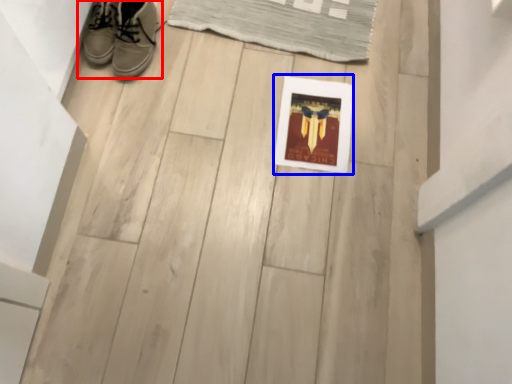
Question: Which of the following is the farthest to the observer, footwear (highlighted by a red box) or picture frame (highlighted by a blue box)?

Choices:
 (A) footwear
 (B) picture frame

Answer: (B)